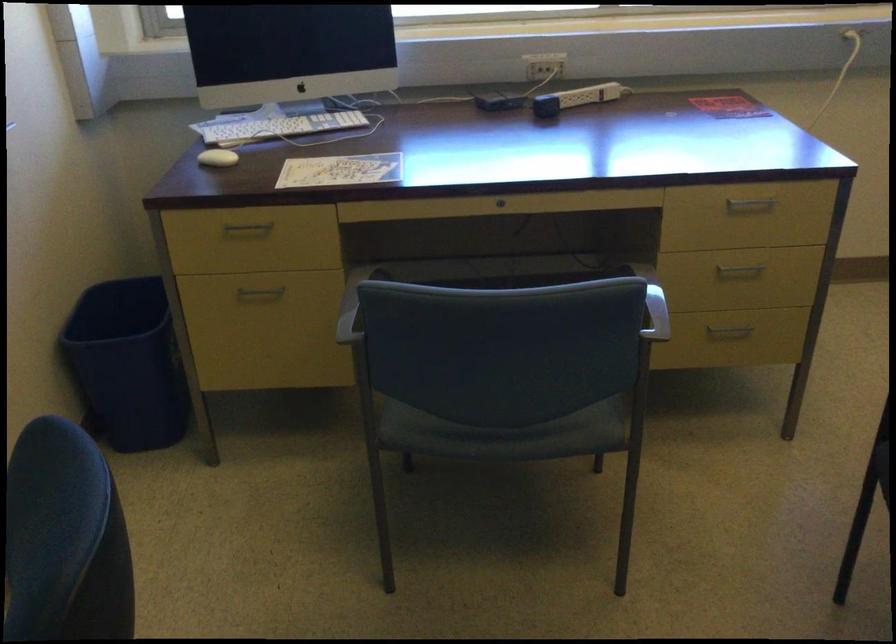
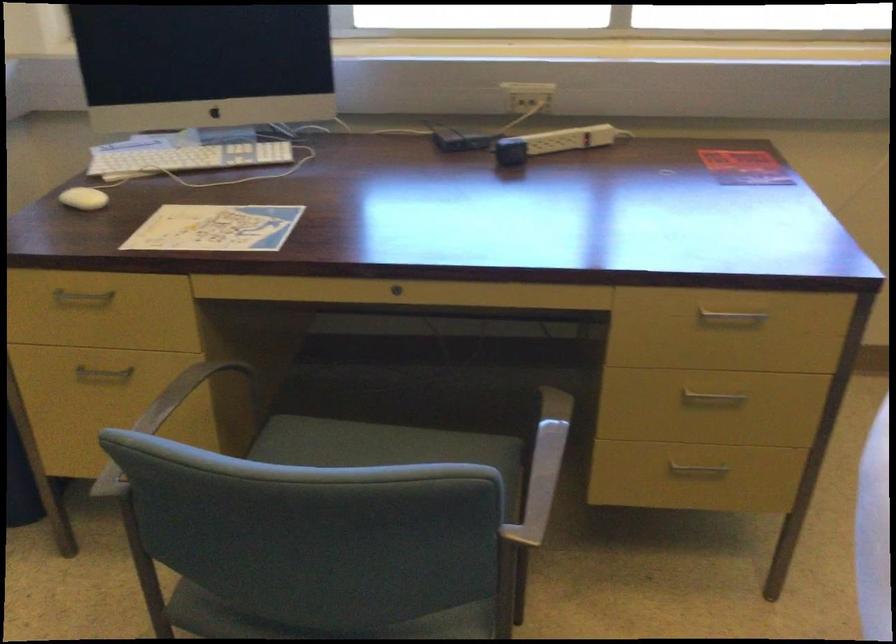
Question: How did the camera likely rotate?

Choices:
 (A) Left
 (B) Right
 (C) Up
 (D) Down

Answer: (A)